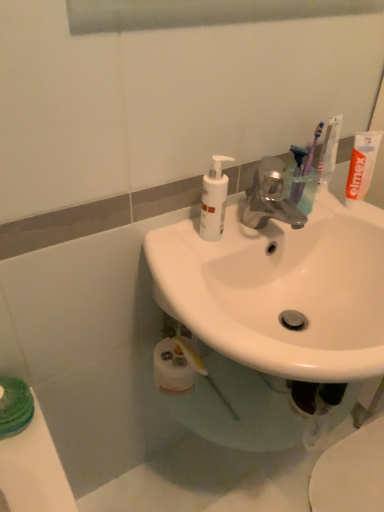
Where is `vacant space to the left of white matte toothpaste at upper right`? vacant space to the left of white matte toothpaste at upper right is located at coordinates (282, 217).